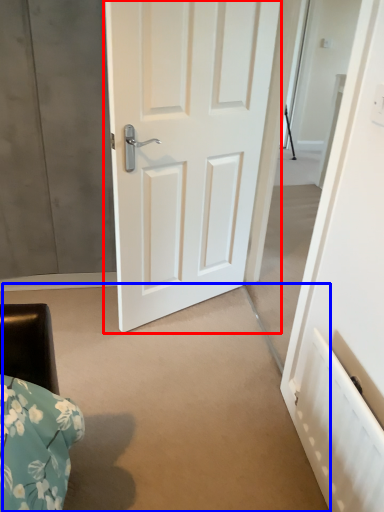
Question: Which point is closer to the camera, door (highlighted by a red box) or concrete (highlighted by a blue box)?

Choices:
 (A) door
 (B) concrete

Answer: (B)